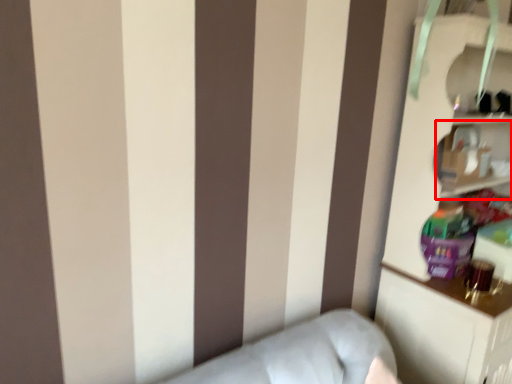
Question: Considering the relative positions of cabinet (annotated by the red box) and bookcase in the image provided, where is cabinet (annotated by the red box) located with respect to the staircase?

Choices:
 (A) left
 (B) right

Answer: (A)